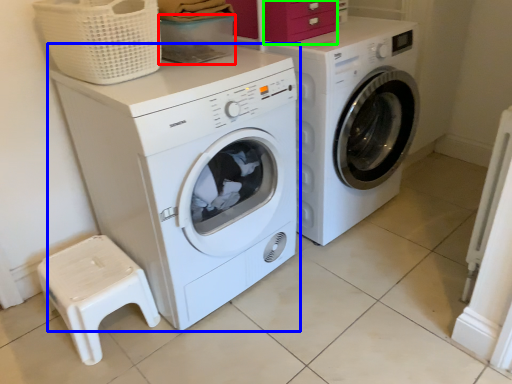
Question: Which object is positioned closest to storage box (highlighted by a red box)? Select from washing machine (highlighted by a blue box) and drawer (highlighted by a green box).

Choices:
 (A) washing machine
 (B) drawer

Answer: (B)